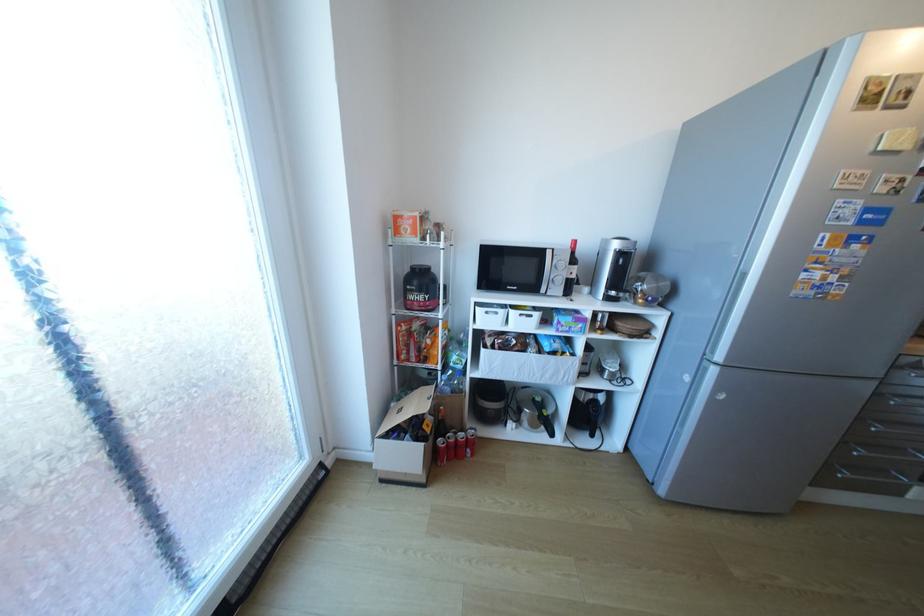
What are the coordinates of `black appliance handle` in the screenshot? It's located at (592, 416).